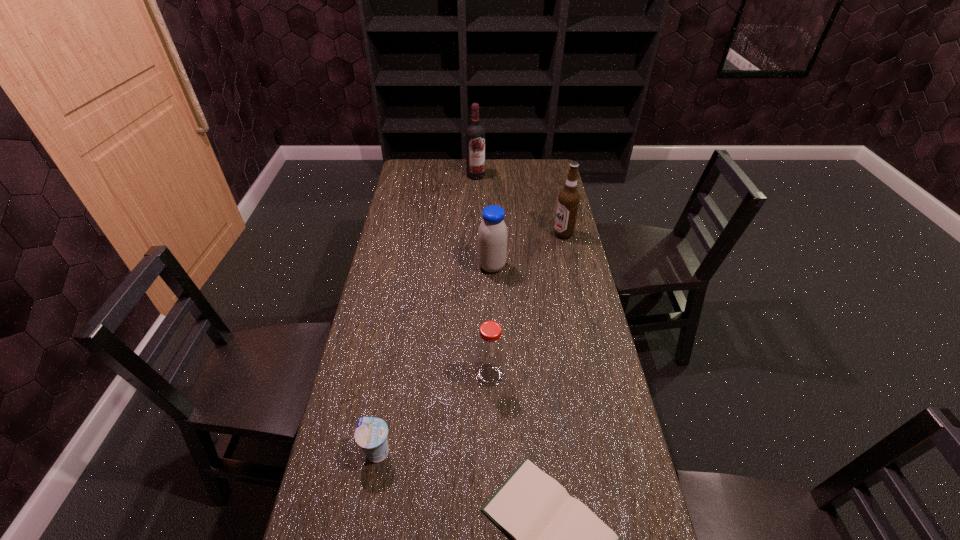
In order to click on vacant area situated on the label of the alcohol in this screenshot , I will do `click(501, 234)`.

Where is `vacant space situated on the label of the alcohol`? This screenshot has height=540, width=960. vacant space situated on the label of the alcohol is located at coordinates (506, 234).

This screenshot has height=540, width=960. Find the location of `vacant space located on the left of the third tallest object`. vacant space located on the left of the third tallest object is located at coordinates (377, 267).

Where is `vacant space situated on the back of the fourth farthest object`? This screenshot has height=540, width=960. vacant space situated on the back of the fourth farthest object is located at coordinates (489, 339).

Where is `vacant space positioned 0.380m on the right of the second shortest object`? This screenshot has height=540, width=960. vacant space positioned 0.380m on the right of the second shortest object is located at coordinates (544, 452).

What are the coordinates of `object located at the far edge` in the screenshot? It's located at (475, 134).

In order to click on object situated at the left edge in this screenshot , I will do point(371,433).

Where is `object that is at the right edge`? The image size is (960, 540). object that is at the right edge is located at coordinates pyautogui.click(x=568, y=201).

In the image, there is a desktop. Identify the location of vacant space at the far edge. The height and width of the screenshot is (540, 960). (488, 170).

This screenshot has height=540, width=960. In order to click on free region at the left edge of the desktop in this screenshot , I will do `click(392, 225)`.